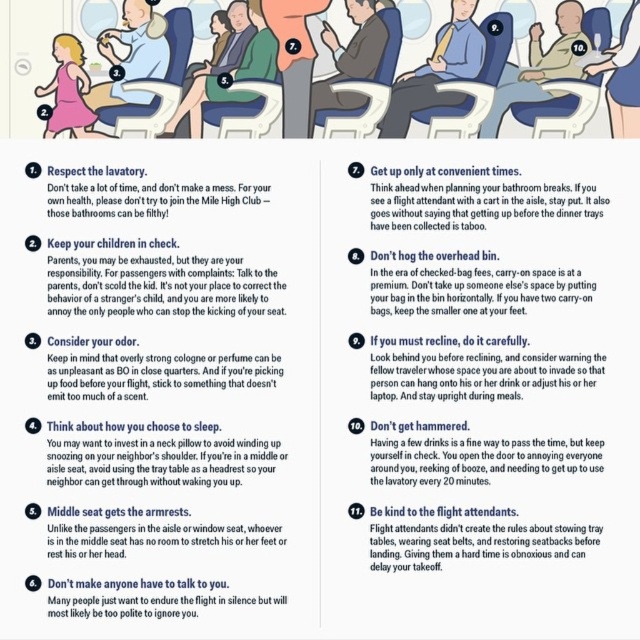
Question: Does white paper text at upper center appear over matte green jacket at center?

Choices:
 (A) no
 (B) yes

Answer: (A)

Question: Among these objects, which one is nearest to the camera?

Choices:
 (A) light beige leather jacket at upper right
 (B) matte black text at upper center

Answer: (A)

Question: Which object is positioned farthest from the matte green jacket at center?

Choices:
 (A) light beige leather jacket at upper right
 (B) matte black laptop at upper right
 (C) pink satin dress at upper left

Answer: (B)

Question: Which point is farther from the camera taking this photo?

Choices:
 (A) (468, 64)
 (B) (579, 28)
 (C) (211, 460)

Answer: (C)

Question: Does light beige leather jacket at upper right have a smaller size compared to matte green jacket at center?

Choices:
 (A) no
 (B) yes

Answer: (B)

Question: Is matte blue shirt at center to the right of dark brown leather jacket at center from the viewer's perspective?

Choices:
 (A) yes
 (B) no

Answer: (A)